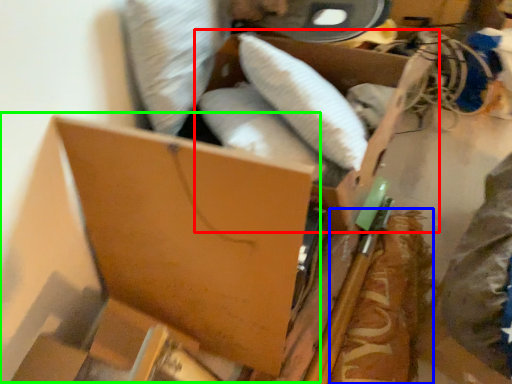
Question: Estimate the real-world distances between objects in this image. Which object is farther from storage box (highlighted by a red box), food (highlighted by a blue box) or storage box (highlighted by a green box)?

Choices:
 (A) food
 (B) storage box

Answer: (B)